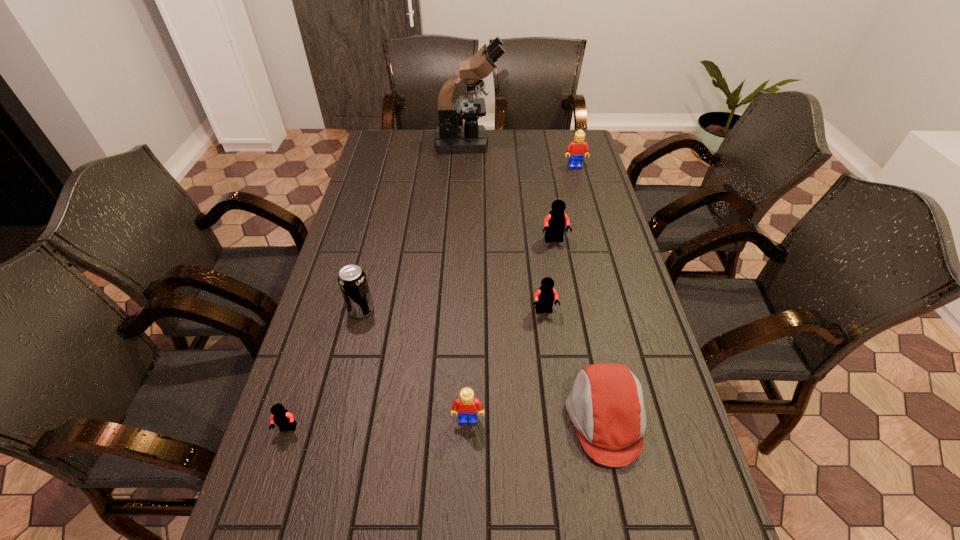
Identify the location of microscope. (451, 137).

Find the location of a particular element. The image size is (960, 540). the farthest object is located at coordinates (451, 137).

At what (x,y) coordinates should I click in order to perform the action: click on the bigger yellow Lego. Please return your answer as a coordinate pair (x, y). Looking at the image, I should click on (577, 148).

Locate an element on the screen. the right yellow Lego is located at coordinates (577, 148).

Find the location of a particular element. The height and width of the screenshot is (540, 960). the third farthest object is located at coordinates (555, 222).

At what (x,y) coordinates should I click in order to perform the action: click on the second farthest Lego. Please return your answer as a coordinate pair (x, y). The width and height of the screenshot is (960, 540). Looking at the image, I should click on (555, 222).

Locate an element on the screen. The image size is (960, 540). the seventh object from right to left is located at coordinates (352, 280).

You are a GUI agent. You are given a task and a screenshot of the screen. Output one action in this format:
    pyautogui.click(x=<x>, y=<y>)
    Task: Click on the second nearest black Lego
    The width and height of the screenshot is (960, 540).
    Given the screenshot: What is the action you would take?
    pyautogui.click(x=544, y=298)

The width and height of the screenshot is (960, 540). Identify the location of the third farthest Lego. (544, 298).

Identify the location of the left yellow Lego. The image size is (960, 540). (466, 405).